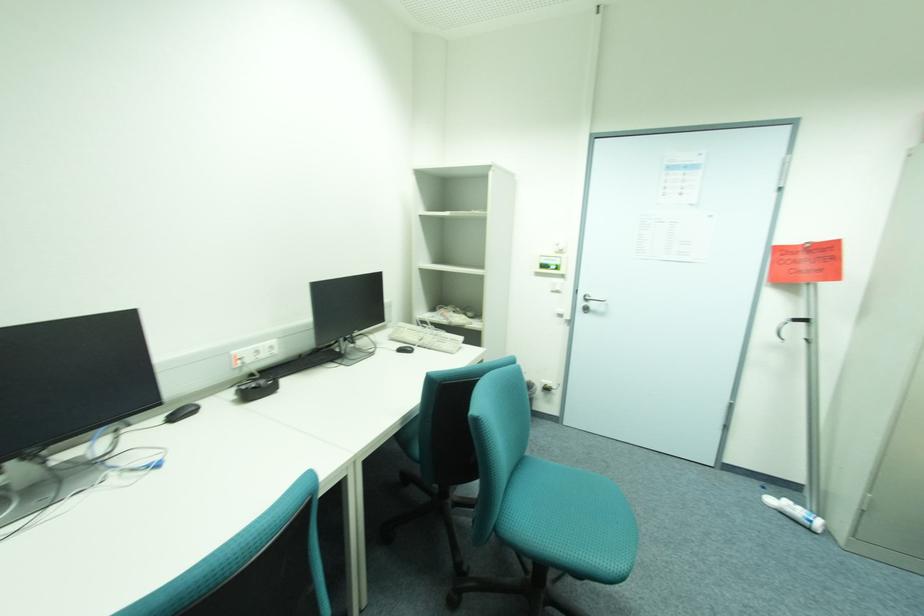
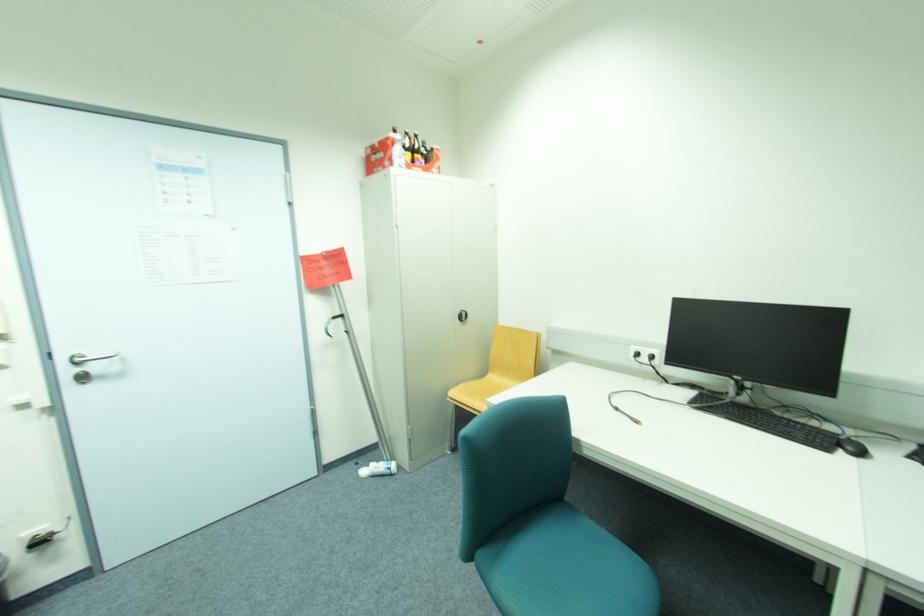
Find the pixel in the second image that matches point (784, 498) in the first image.

(373, 468)